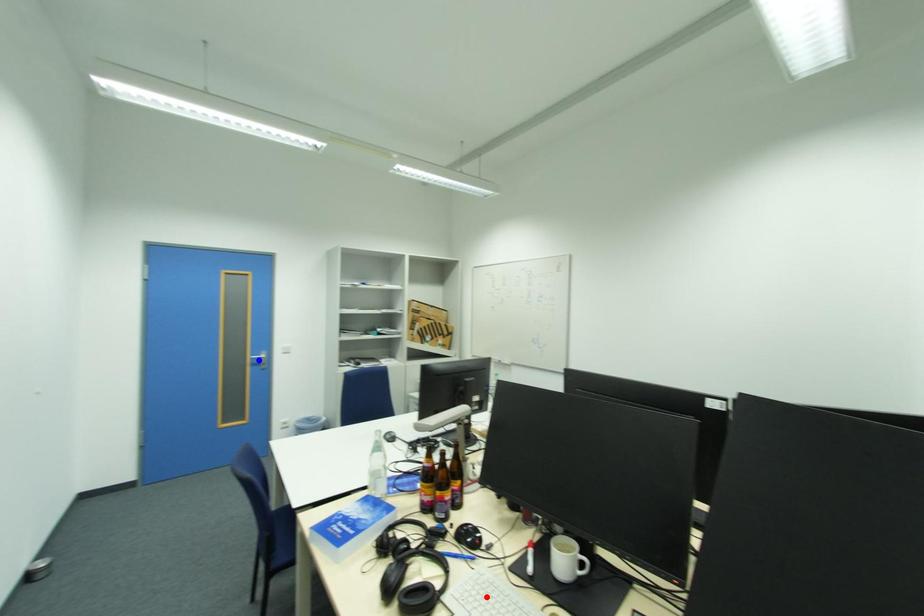
Question: Two points are marked on the image. Which point is closer to the camera?

Choices:
 (A) Blue point is closer.
 (B) Red point is closer.

Answer: (B)